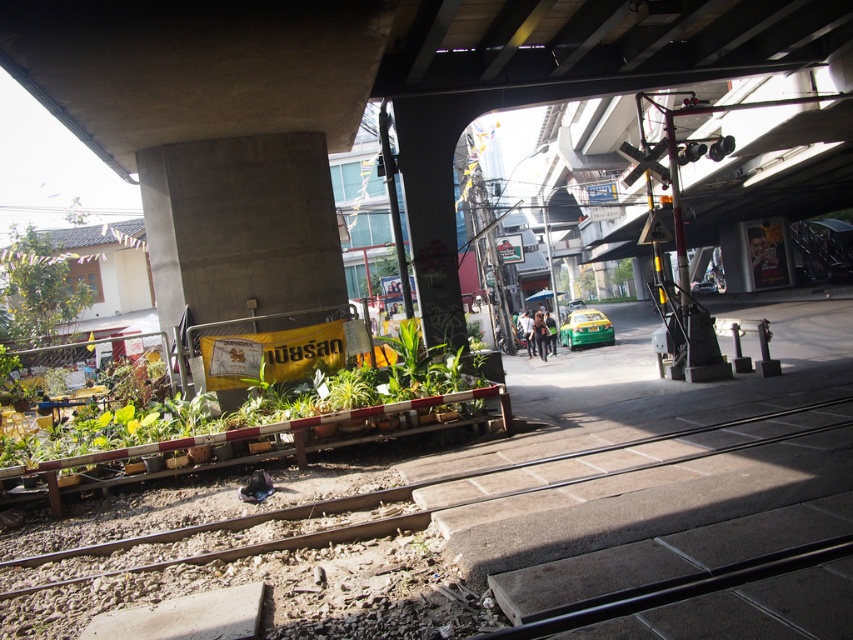
You are a pedestrian standing at the base of the overpass. You see the concrete at upper center and the green leafy plants at left. Which object is positioned to the right of the other?

The concrete at upper center is positioned to the right of the green leafy plants at left.

You are a city planner assessing the space under an overpass. You notice the concrete at upper center and the brown wooden train track at lower left. Which of these two objects occupies a larger horizontal space in the scene?

The concrete at upper center has a greater width than the brown wooden train track at lower left, so it occupies a larger horizontal space in the scene.

You are standing at point (392, 490) in the scene. What object is located at that point?

The brown wooden train track at lower left is located at point (392, 490).